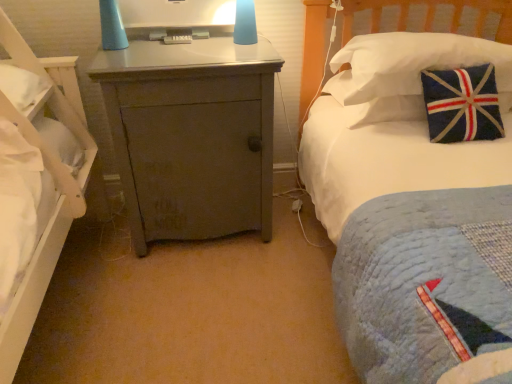
Question: In terms of size, does white fabric pillow at upper right appear bigger or smaller than matte plastic monitor at center?

Choices:
 (A) big
 (B) small

Answer: (A)

Question: From the image's perspective, is white fabric pillow at upper right located above or below matte plastic monitor at center?

Choices:
 (A) above
 (B) below

Answer: (B)

Question: Estimate the real-world distances between objects in this image. Which object is closer to the white fabric pillow at upper right?

Choices:
 (A) matte gray cabinet at center
 (B) matte plastic monitor at center

Answer: (A)

Question: Estimate the real-world distances between objects in this image. Which object is closer to the matte plastic monitor at center?

Choices:
 (A) white fabric pillow at upper right
 (B) matte gray cabinet at center

Answer: (B)